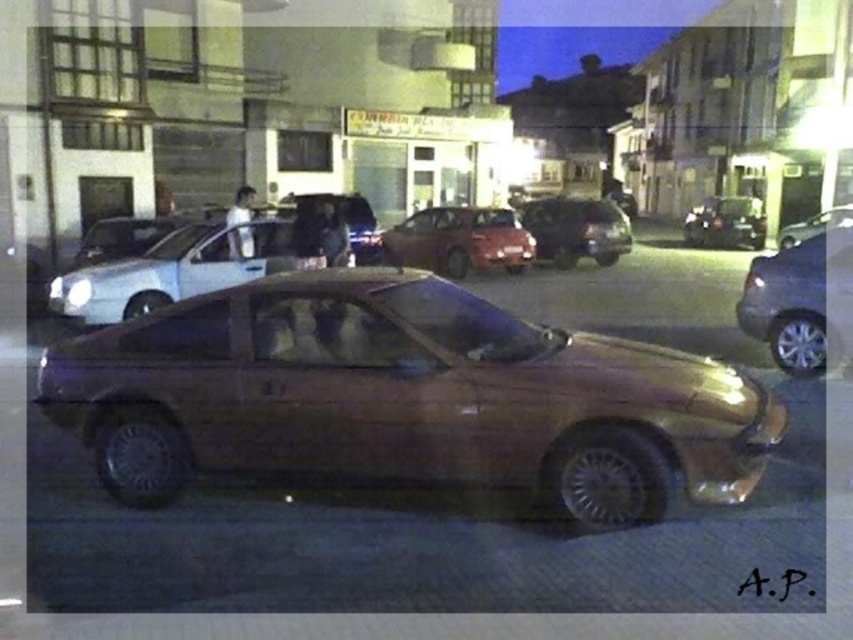
Question: Observing the image, what is the correct spatial positioning of satin gold car at center in reference to shiny silver car at right?

Choices:
 (A) below
 (B) above

Answer: (B)

Question: Which point is closer to the camera?

Choices:
 (A) (695, 240)
 (B) (602, 211)

Answer: (B)

Question: Which of the following is the closest to the observer?

Choices:
 (A) shiny black car at right
 (B) shiny silver sedan at right
 (C) black plastic license plate at center

Answer: (B)

Question: Is shiny red car at center above shiny silver car at right?

Choices:
 (A) yes
 (B) no

Answer: (B)

Question: Among these points, which one is farthest from the camera?

Choices:
 (A) (730, 216)
 (B) (445, 205)
 (C) (548, 230)

Answer: (A)

Question: Observing the image, what is the correct spatial positioning of satin silver car at center in reference to shiny silver sedan at right?

Choices:
 (A) above
 (B) below

Answer: (A)